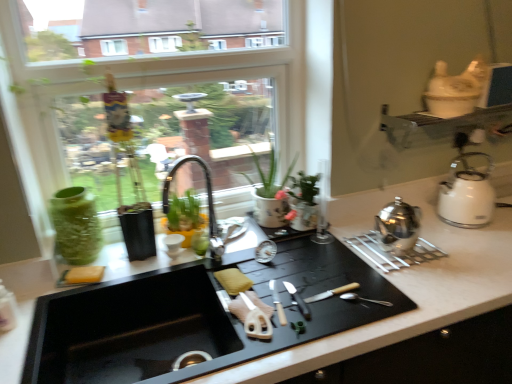
Question: From a real-world perspective, is matte black faucet at center physically located above or below silver metallic knife at center, the second knife from the left?

Choices:
 (A) below
 (B) above

Answer: (B)

Question: Considering the positions of point (216, 249) and point (295, 302), is point (216, 249) closer or farther from the camera than point (295, 302)?

Choices:
 (A) closer
 (B) farther

Answer: (B)

Question: Estimate the real-world distances between objects in this image. Which object is closer to the satin silver teapot at right, marked as the 2th kitchen appliance in a right-to-left arrangement?

Choices:
 (A) yellow sponge at sink, the 2th food in the right-to-left sequence
 (B) green glass vase at left
 (C) matte black faucet at center
 (D) white glossy kettle at right, the 2th kitchen appliance positioned from the front
 (E) green matte pot at center

Answer: (D)

Question: Which of these objects is positioned closest to the transparent glass window at upper center?

Choices:
 (A) satin silver teapot at right, acting as the 1th kitchen appliance starting from the front
 (B) silver metallic knife at center, which appears as the 1th knife when viewed from the left
 (C) yellow sponge at sink, the first food in the right-to-left sequence
 (D) matte black faucet at center
 (E) green glass vase at left

Answer: (E)